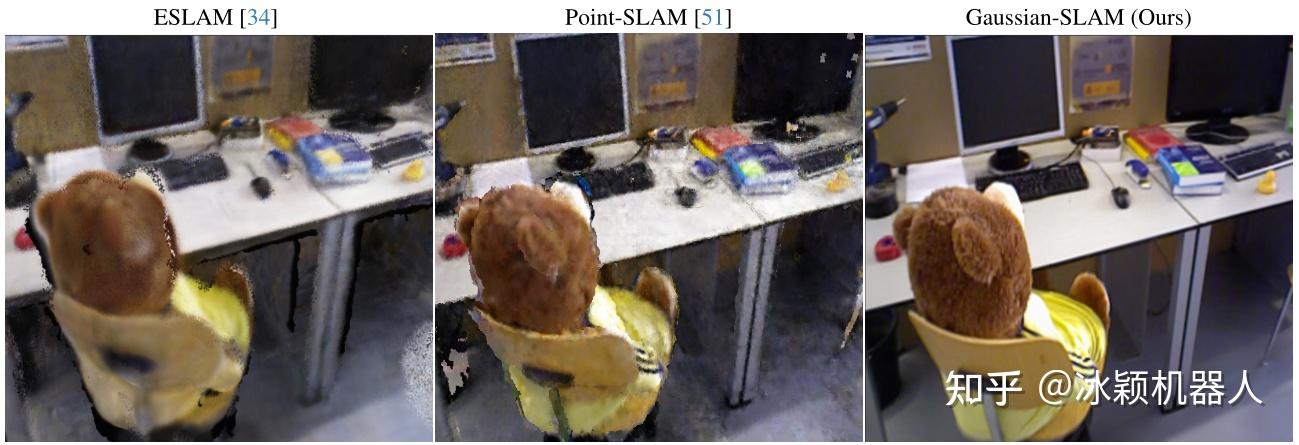
Where is `black keyboard`? The height and width of the screenshot is (445, 1299). black keyboard is located at coordinates (204, 168).